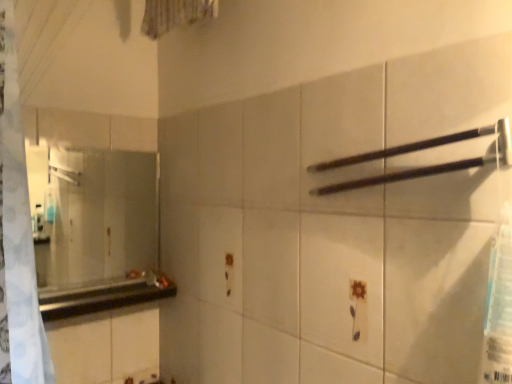
This screenshot has width=512, height=384. What are the coordinates of `black glossy counter top at left` in the screenshot? It's located at (102, 298).

Where is `clear glass mirror at left`? The width and height of the screenshot is (512, 384). clear glass mirror at left is located at coordinates (98, 218).

From a real-world perspective, is clear glass mirror at left positioned under black matte towel bar at upper right based on gravity?

Yes, from a real-world perspective, clear glass mirror at left is under black matte towel bar at upper right.

Considering the sizes of clear glass mirror at left and black matte towel bar at upper right in the image, is clear glass mirror at left wider or thinner than black matte towel bar at upper right?

Clearly, clear glass mirror at left has less width compared to black matte towel bar at upper right.

Which of these two, clear glass mirror at left or black matte towel bar at upper right, stands taller?

With more height is clear glass mirror at left.

Based on the photo, would you consider clear glass mirror at left to be distant from black matte towel bar at upper right?

Yes, clear glass mirror at left is far from black matte towel bar at upper right.

Does clear glass mirror at left turn towards black glossy counter top at left?

Yes, clear glass mirror at left is oriented towards black glossy counter top at left.

Considering the relative positions of clear glass mirror at left and black glossy counter top at left in the image provided, is clear glass mirror at left to the left or to the right of black glossy counter top at left?

In the image, clear glass mirror at left appears on the left side of black glossy counter top at left.

Does point (35, 252) appear closer or farther from the camera than point (169, 288)?

Point (35, 252) is positioned farther from the camera compared to point (169, 288).

From a real-world perspective, which object stands above the other?

black matte towel bar at upper right.

This screenshot has width=512, height=384. What are the coordinates of `towel bar in front of the clear glass mirror at left` in the screenshot? It's located at (422, 167).

Which of these two, black matte towel bar at upper right or clear glass mirror at left, stands shorter?

black matte towel bar at upper right.

From the image's perspective, between black matte towel bar at upper right and clear glass mirror at left, which one is located above?

black matte towel bar at upper right, from the image's perspective.

Is point (48, 295) less distant than point (82, 181)?

Yes, point (48, 295) is in front of point (82, 181).

Looking at this image, from the image's perspective, which object appears higher, black glossy counter top at left or clear glass mirror at left?

clear glass mirror at left.

Looking at this image, is black glossy counter top at left next to clear glass mirror at left?

black glossy counter top at left and clear glass mirror at left are clearly separated.

In the scene shown: In terms of height, does black glossy counter top at left look taller or shorter compared to clear glass mirror at left?

Clearly, black glossy counter top at left is shorter compared to clear glass mirror at left.

Visually, is black matte towel bar at upper right positioned to the left or to the right of black glossy counter top at left?

Based on their positions, black matte towel bar at upper right is located to the right of black glossy counter top at left.

Considering the sizes of objects black matte towel bar at upper right and black glossy counter top at left in the image provided, who is taller, black matte towel bar at upper right or black glossy counter top at left?

black matte towel bar at upper right.

Is black matte towel bar at upper right surrounding black glossy counter top at left?

No, black glossy counter top at left is not a part of black matte towel bar at upper right.

Who is bigger, black glossy counter top at left or black matte towel bar at upper right?

Bigger between the two is black glossy counter top at left.

In the image, is black glossy counter top at left positioned in front of or behind black matte towel bar at upper right?

In the image, black glossy counter top at left appears behind black matte towel bar at upper right.

Is black glossy counter top at left thinner than black matte towel bar at upper right?

In fact, black glossy counter top at left might be wider than black matte towel bar at upper right.

This screenshot has height=384, width=512. Identify the location of mirror on the left of black matte towel bar at upper right. (98, 218).

Locate an element on the screen. Image resolution: width=512 pixels, height=384 pixels. counter top below the clear glass mirror at left (from the image's perspective) is located at coordinates (102, 298).

Considering their positions, is black glossy counter top at left positioned further to clear glass mirror at left than black matte towel bar at upper right?

black matte towel bar at upper right is further to clear glass mirror at left.

Looking at the image, which one is located closer to black glossy counter top at left, clear glass mirror at left or black matte towel bar at upper right?

clear glass mirror at left is closer to black glossy counter top at left.

Looking at this image, when comparing their distances from black matte towel bar at upper right, does clear glass mirror at left or black glossy counter top at left seem further?

Among the two, clear glass mirror at left is located further to black matte towel bar at upper right.

Based on their spatial positions, is black glossy counter top at left or clear glass mirror at left closer to black matte towel bar at upper right?

The object closer to black matte towel bar at upper right is black glossy counter top at left.

When comparing their distances from clear glass mirror at left, does black matte towel bar at upper right or black glossy counter top at left seem further?

Based on the image, black matte towel bar at upper right appears to be further to clear glass mirror at left.

Considering their positions, is black matte towel bar at upper right positioned closer to black glossy counter top at left than clear glass mirror at left?

Among the two, clear glass mirror at left is located nearer to black glossy counter top at left.

Where is `counter top located between clear glass mirror at left and black matte towel bar at upper right in the left-right direction`? counter top located between clear glass mirror at left and black matte towel bar at upper right in the left-right direction is located at coordinates (102, 298).